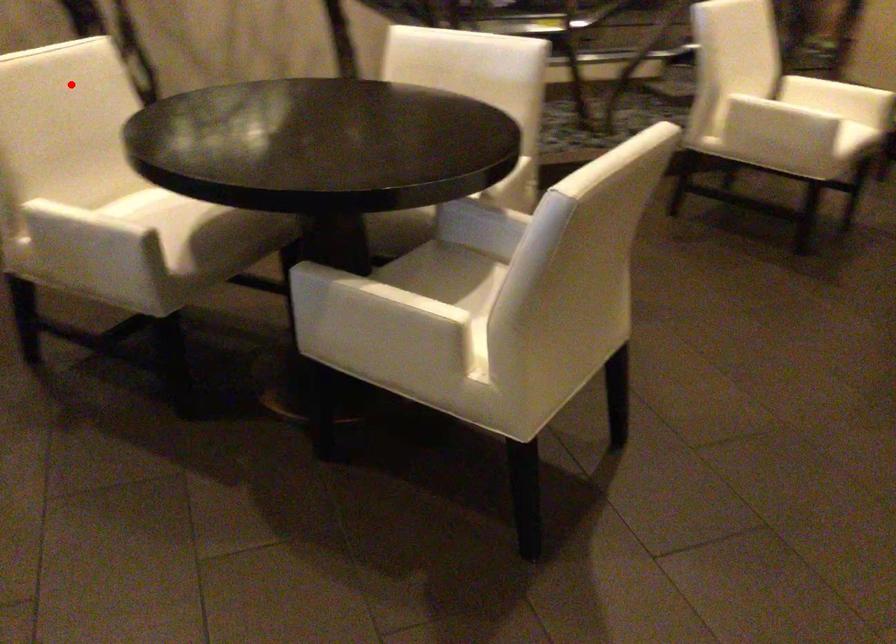
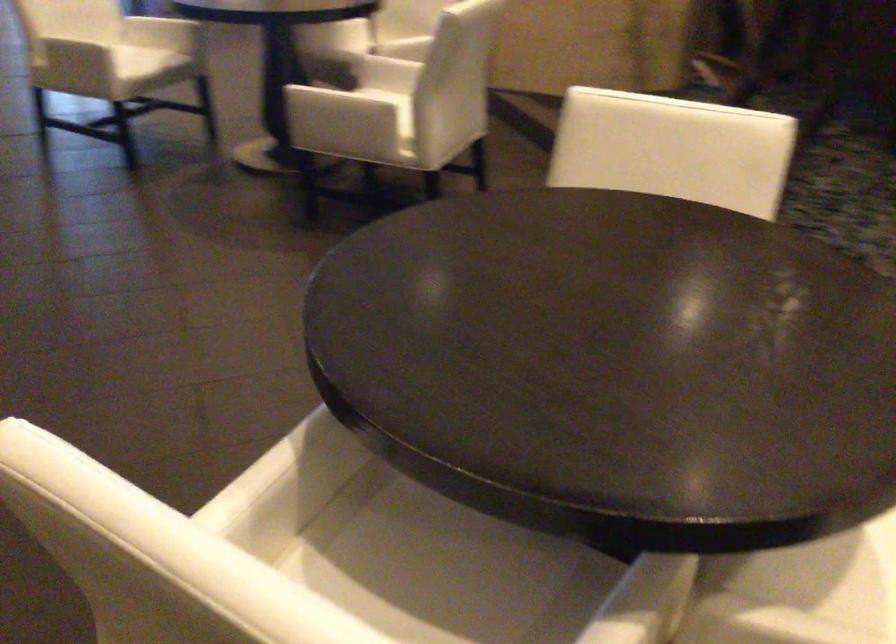
The point at the highlighted location is marked in the first image. Where is the corresponding point in the second image?

(673, 149)